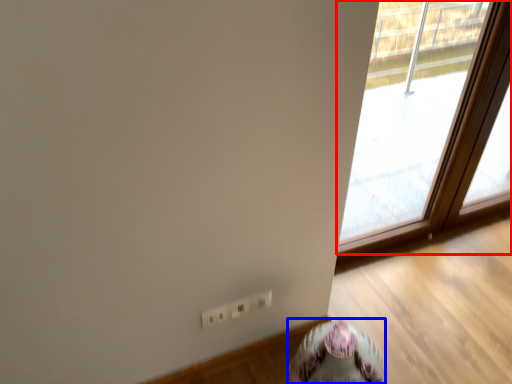
Question: Which object appears farthest to the camera in this image, window (highlighted by a red box) or round table (highlighted by a blue box)?

Choices:
 (A) window
 (B) round table

Answer: (A)